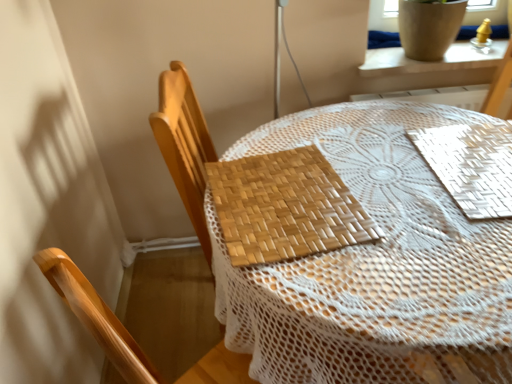
The width and height of the screenshot is (512, 384). Identify the location of empty space that is ontop of white ceramic pot at upper right (from a real-world perspective). (397, 55).